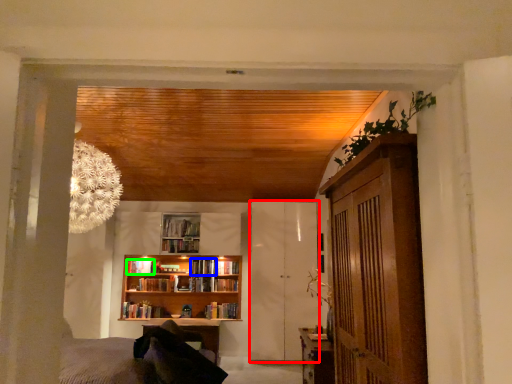
Question: Which object is positioned farthest from barn door (highlighted by a red box)? Select from book (highlighted by a blue box) and book (highlighted by a green box).

Choices:
 (A) book
 (B) book

Answer: (B)